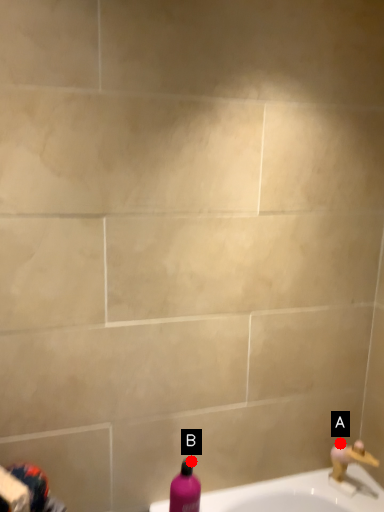
Question: Two points are circled on the image, labeled by A and B beside each circle. Among these points, which one is nearest to the camera?

Choices:
 (A) A is closer
 (B) B is closer

Answer: (B)